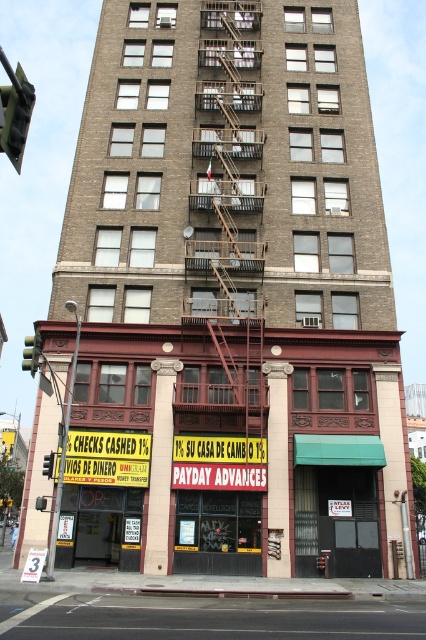
Can you confirm if green plastic traffic light at upper left is taller than green glass traffic light at left?

Indeed, green plastic traffic light at upper left has a greater height compared to green glass traffic light at left.

Where is `green plastic traffic light at upper left`? This screenshot has height=640, width=426. green plastic traffic light at upper left is located at coordinates (14, 112).

Between point (31, 106) and point (39, 342), which one is positioned behind?

Positioned behind is point (39, 342).

Find the location of `green plastic traffic light at upper left`. green plastic traffic light at upper left is located at coordinates (14, 112).

Can you confirm if white paper sign at lower left is shorter than yellow plastic traffic light at center?

Indeed, white paper sign at lower left has a lesser height compared to yellow plastic traffic light at center.

Looking at this image, does white paper sign at lower left appear on the right side of yellow plastic traffic light at center?

No, white paper sign at lower left is not to the right of yellow plastic traffic light at center.

Who is more forward, (45, 548) or (46, 476)?

Positioned in front is point (46, 476).

This screenshot has height=640, width=426. What are the coordinates of `white paper sign at lower left` in the screenshot? It's located at (34, 564).

From the picture: Does yellow signboard at center appear under white paper sign at lower left?

No.

The height and width of the screenshot is (640, 426). Find the location of `yellow signboard at center`. yellow signboard at center is located at coordinates (242, 449).